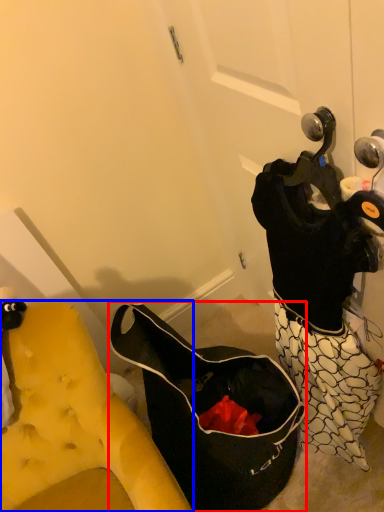
Question: Which object is further to the camera taking this photo, handbag (highlighted by a red box) or furniture (highlighted by a blue box)?

Choices:
 (A) handbag
 (B) furniture

Answer: (A)